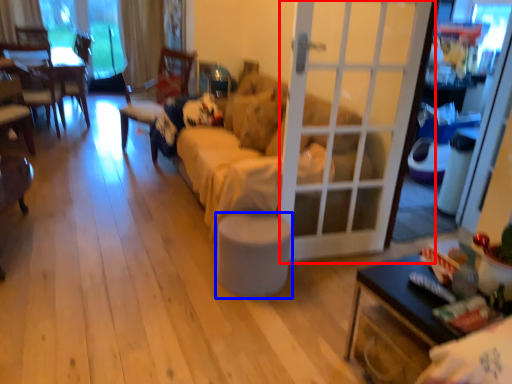
Question: Which object is closer to the camera taking this photo, door (highlighted by a red box) or stool (highlighted by a blue box)?

Choices:
 (A) door
 (B) stool

Answer: (A)